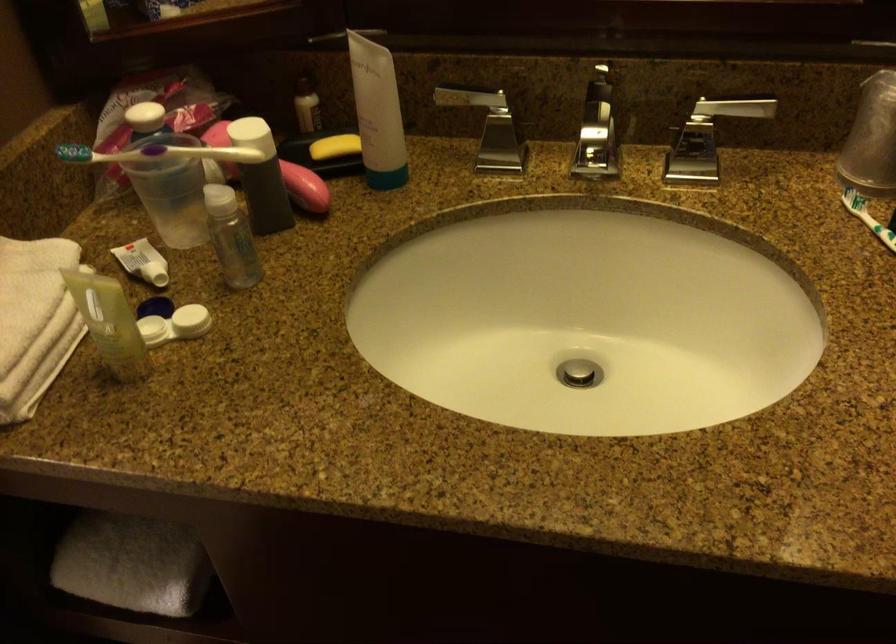
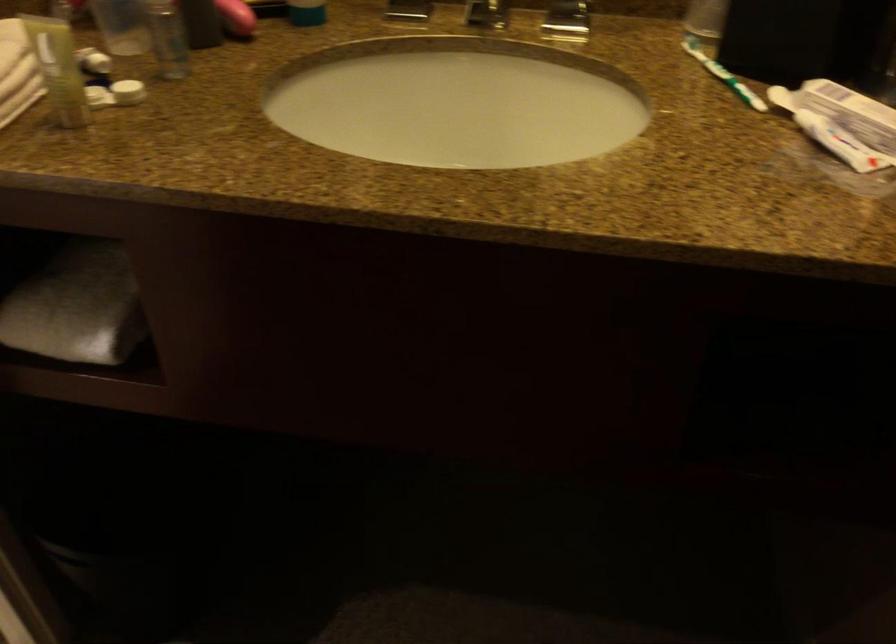
Where in the second image is the point corresponding to [563,263] from the first image?

(457, 102)